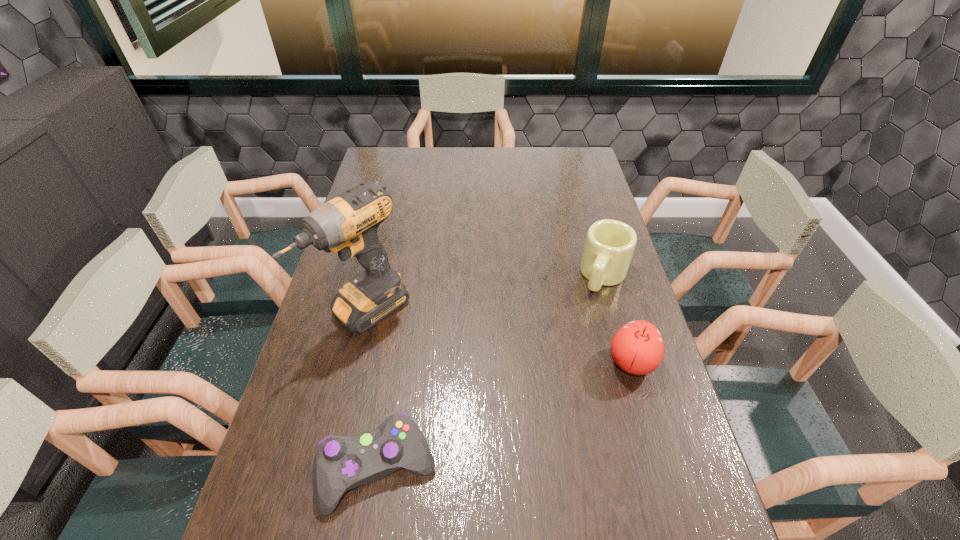
This screenshot has width=960, height=540. I want to click on free space located with the handle on the side of the mug, so click(x=569, y=364).

This screenshot has height=540, width=960. I want to click on blank area located with the handle on the side of the mug, so click(579, 342).

Where is `free space located with the handle on the side of the mug`? This screenshot has width=960, height=540. free space located with the handle on the side of the mug is located at coordinates (562, 382).

Find the location of `object that is at the near edge`. object that is at the near edge is located at coordinates (341, 463).

Where is `control located at the left edge`? control located at the left edge is located at coordinates (341, 463).

Identify the location of drill at the left edge. This screenshot has width=960, height=540. (348, 224).

Locate an element on the screen. The width and height of the screenshot is (960, 540). apple positioned at the right edge is located at coordinates [637, 348].

This screenshot has height=540, width=960. I want to click on mug at the right edge, so click(x=609, y=246).

Locate an element on the screen. object at the near left corner is located at coordinates pos(341,463).

Where is `vacant space at the near edge`? This screenshot has width=960, height=540. vacant space at the near edge is located at coordinates (457, 497).